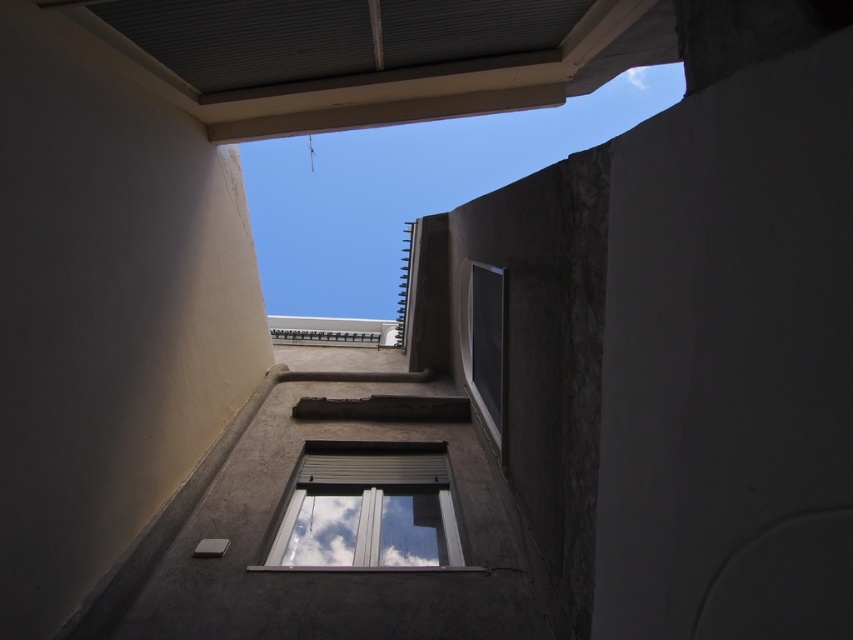
You are standing in the narrow alleyway between two buildings and looking up towards the sky. There is a white plastic window at center. Can you see the sky through the window?

The white plastic window at center has a partially open blind, allowing a view of the sky and some clouds reflected in the glass, so yes, you can see the sky through the white plastic window at center.